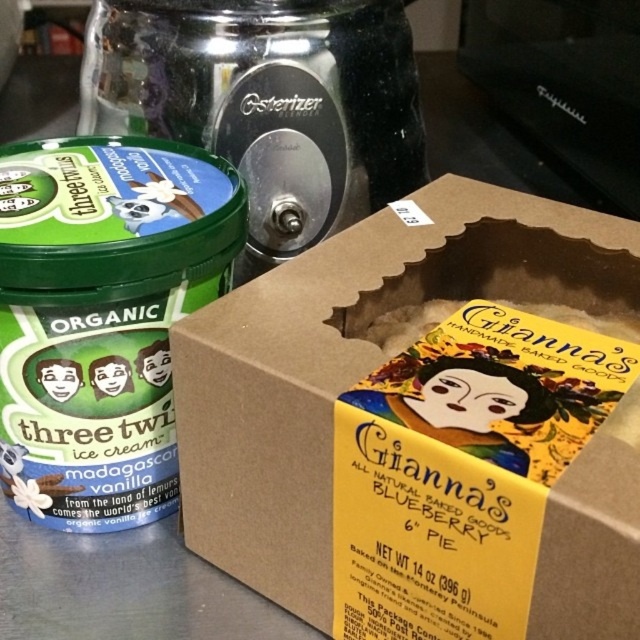
Question: Is brown cardboard box at center to the right of green matte ice cream container at left from the viewer's perspective?

Choices:
 (A) no
 (B) yes

Answer: (B)

Question: Is brown cardboard box at center behind green matte ice cream container at left?

Choices:
 (A) no
 (B) yes

Answer: (A)

Question: Does brown cardboard box at center appear under green matte ice cream container at left?

Choices:
 (A) yes
 (B) no

Answer: (A)

Question: Which point is farther to the camera?

Choices:
 (A) green matte ice cream container at left
 (B) brown cardboard box at center

Answer: (A)